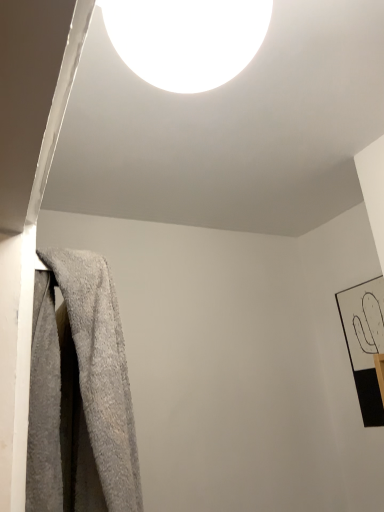
Question: Based on their sizes in the image, would you say white glossy light fixture at upper center is bigger or smaller than gray fluffy towel at left?

Choices:
 (A) big
 (B) small

Answer: (B)

Question: From the image's perspective, relative to gray fluffy towel at left, is white glossy light fixture at upper center above or below?

Choices:
 (A) above
 (B) below

Answer: (A)

Question: Which is farther from the white glossy light fixture at upper center?

Choices:
 (A) gray fluffy towel at left
 (B) black matte picture frame at right

Answer: (B)

Question: Which of these objects is positioned farthest from the black matte picture frame at right?

Choices:
 (A) white glossy light fixture at upper center
 (B) gray fluffy towel at left

Answer: (A)